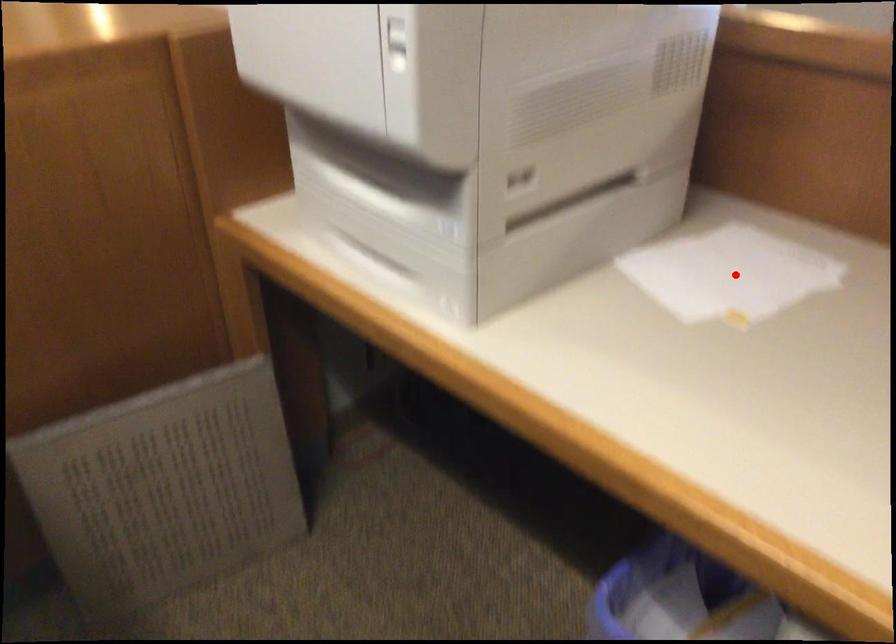
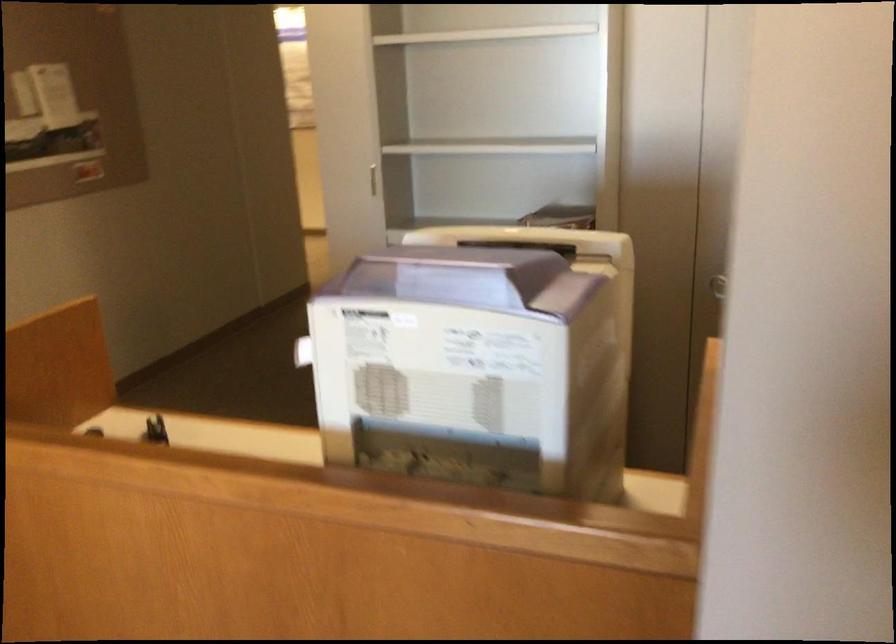
Question: I am providing you with two images of the same scene from different viewpoints. A red point is marked on the first image. Is the red point's position out of view in image 2?

Choices:
 (A) Yes
 (B) No

Answer: (A)